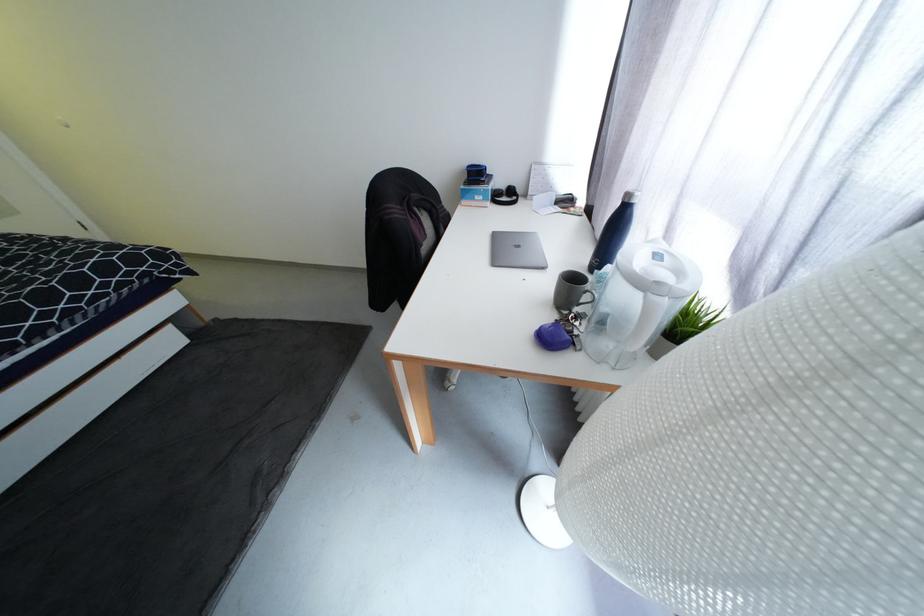
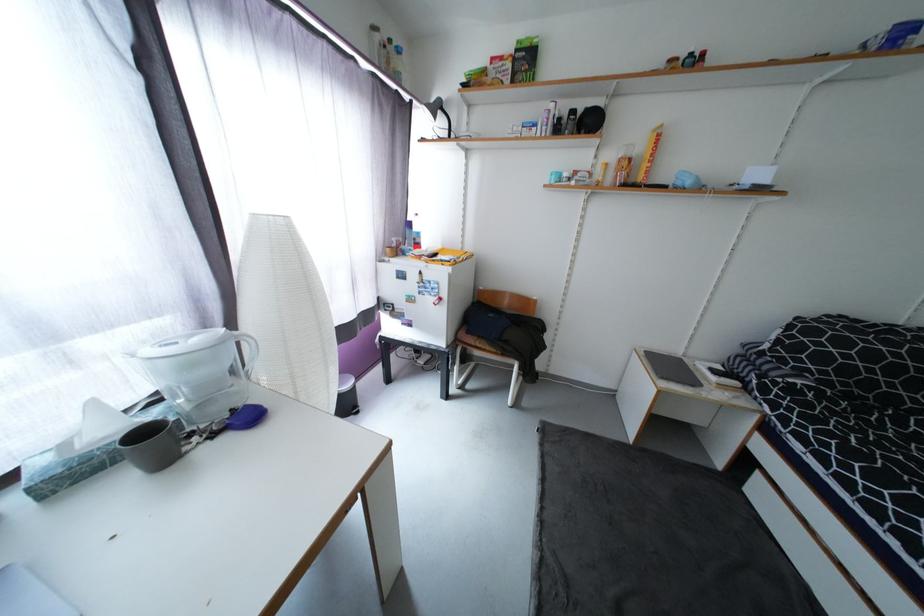
Locate, in the second image, the point that corresponds to [249,541] in the first image.

(548, 524)